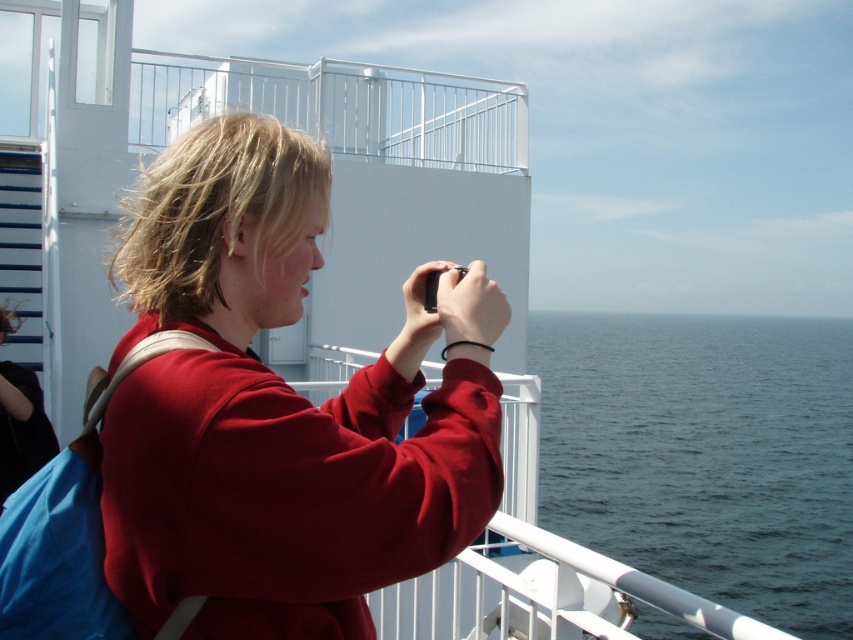
Between blue water at right and matte black jacket at left, which one has more height?

Standing taller between the two is blue water at right.

Who is higher up, blue water at right or matte black jacket at left?

matte black jacket at left

Describe the element at coordinates (705, 454) in the screenshot. The height and width of the screenshot is (640, 853). I see `blue water at right` at that location.

This screenshot has height=640, width=853. Find the location of `blue water at right`. blue water at right is located at coordinates (705, 454).

Can you confirm if matte red sweatshirt at center is smaller than matte black jacket at left?

No, matte red sweatshirt at center is not smaller than matte black jacket at left.

Which is above, matte red sweatshirt at center or matte black jacket at left?

matte red sweatshirt at center

What are the coordinates of `matte red sweatshirt at center` in the screenshot? It's located at (279, 408).

Which is below, white metal railing at upper center or matte black jacket at left?

matte black jacket at left

Is point (310, 65) positioned in front of point (28, 429)?

No, (310, 65) is further to viewer.

Where is `white metal railing at upper center`? This screenshot has height=640, width=853. white metal railing at upper center is located at coordinates (340, 108).

This screenshot has width=853, height=640. I want to click on white metal railing at upper center, so click(340, 108).